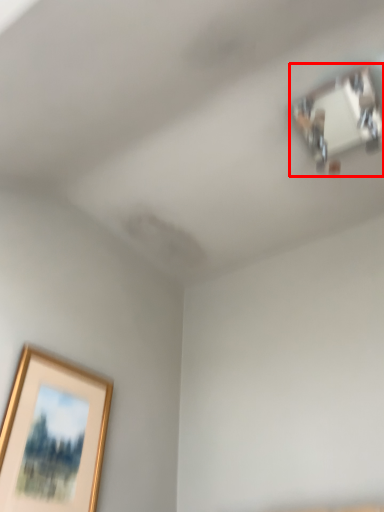
Question: From the image's perspective, where is wide (annotated by the red box) located in relation to picture frame in the image?

Choices:
 (A) below
 (B) above

Answer: (B)